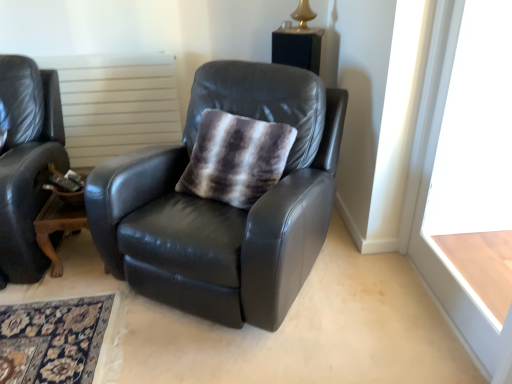
Question: From a real-world perspective, does brown wooden table at lower left sit lower than white wood window frame at right?

Choices:
 (A) yes
 (B) no

Answer: (A)

Question: Would you say brown wooden table at lower left contains white wood window frame at right?

Choices:
 (A) yes
 (B) no

Answer: (B)

Question: From the image's perspective, is brown wooden table at lower left above white wood window frame at right?

Choices:
 (A) no
 (B) yes

Answer: (A)

Question: Would you say brown wooden table at lower left is outside white wood window frame at right?

Choices:
 (A) yes
 (B) no

Answer: (A)

Question: Is brown wooden table at lower left far away from white wood window frame at right?

Choices:
 (A) no
 (B) yes

Answer: (B)

Question: Is brown wooden table at lower left placed right next to white wood window frame at right?

Choices:
 (A) no
 (B) yes

Answer: (A)

Question: From the image's perspective, is fuzzy brown and white throw pillow at center on top of brown wooden table at lower left?

Choices:
 (A) no
 (B) yes

Answer: (B)

Question: Can you confirm if fuzzy brown and white throw pillow at center is thinner than brown wooden table at lower left?

Choices:
 (A) yes
 (B) no

Answer: (A)

Question: Considering the relative positions of fuzzy brown and white throw pillow at center and brown wooden table at lower left in the image provided, is fuzzy brown and white throw pillow at center to the left of brown wooden table at lower left from the viewer's perspective?

Choices:
 (A) no
 (B) yes

Answer: (A)

Question: Can brown wooden table at lower left be found inside fuzzy brown and white throw pillow at center?

Choices:
 (A) yes
 (B) no

Answer: (B)

Question: From a real-world perspective, is fuzzy brown and white throw pillow at center under brown wooden table at lower left?

Choices:
 (A) yes
 (B) no

Answer: (B)

Question: Does fuzzy brown and white throw pillow at center have a greater width compared to brown wooden table at lower left?

Choices:
 (A) yes
 (B) no

Answer: (B)

Question: From the image's perspective, does white wood window frame at right appear higher than white textured radiator at upper center?

Choices:
 (A) yes
 (B) no

Answer: (B)